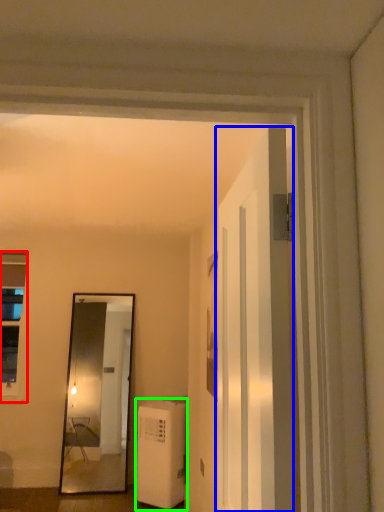
Question: Considering the real-world distances, which object is closest to window (highlighted by a red box)? door (highlighted by a blue box) or air conditioner (highlighted by a green box).

Choices:
 (A) door
 (B) air conditioner

Answer: (B)